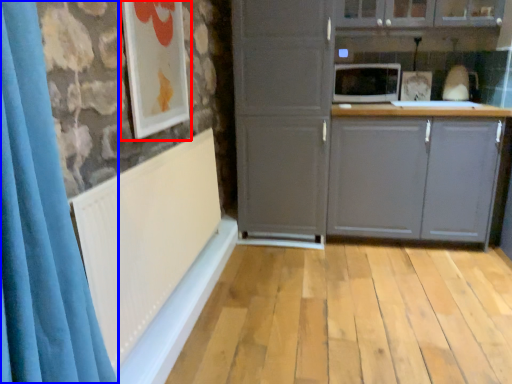
Question: Which point is closer to the camera, picture frame (highlighted by a red box) or shower curtain (highlighted by a blue box)?

Choices:
 (A) picture frame
 (B) shower curtain

Answer: (B)